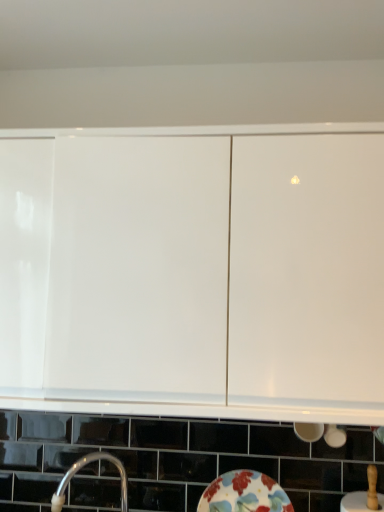
Locate an element on the screen. floral ceramic plate at lower center is located at coordinates (244, 494).

The width and height of the screenshot is (384, 512). Describe the element at coordinates (80, 469) in the screenshot. I see `silver metallic tap at lower left` at that location.

Locate an element on the screen. floral ceramic plate at lower center is located at coordinates (244, 494).

From the image's perspective, between silver metallic tap at lower left and white glossy cabinet at upper center, which one is located above?

white glossy cabinet at upper center appears higher in the image.

From their relative heights in the image, would you say silver metallic tap at lower left is taller or shorter than white glossy cabinet at upper center?

silver metallic tap at lower left is shorter than white glossy cabinet at upper center.

Does silver metallic tap at lower left have a greater width compared to white glossy cabinet at upper center?

In fact, silver metallic tap at lower left might be narrower than white glossy cabinet at upper center.

Choose the correct answer: Is silver metallic tap at lower left inside white glossy cabinet at upper center or outside it?

silver metallic tap at lower left is not enclosed by white glossy cabinet at upper center.

In terms of size, does floral ceramic plate at lower center appear bigger or smaller than white glossy cabinet at upper center?

In the image, floral ceramic plate at lower center appears to be smaller than white glossy cabinet at upper center.

Considering the sizes of floral ceramic plate at lower center and white glossy cabinet at upper center in the image, is floral ceramic plate at lower center taller or shorter than white glossy cabinet at upper center?

In the image, floral ceramic plate at lower center appears to be shorter than white glossy cabinet at upper center.

Is floral ceramic plate at lower center positioned with its back to white glossy cabinet at upper center?

No, floral ceramic plate at lower center's orientation is not away from white glossy cabinet at upper center.

From a real-world perspective, relative to floral ceramic plate at lower center, is silver metallic tap at lower left vertically above or below?

From a real-world perspective, silver metallic tap at lower left is physically above floral ceramic plate at lower center.

Would you say silver metallic tap at lower left is a long distance from floral ceramic plate at lower center?

silver metallic tap at lower left is actually quite close to floral ceramic plate at lower center.

Can you tell me how much silver metallic tap at lower left and floral ceramic plate at lower center differ in facing direction?

silver metallic tap at lower left and floral ceramic plate at lower center are facing 54.7 degrees away from each other.

Can you confirm if silver metallic tap at lower left is smaller than floral ceramic plate at lower center?

Incorrect, silver metallic tap at lower left is not smaller in size than floral ceramic plate at lower center.

Consider the image. Is white glossy cabinet at upper center wider or thinner than silver metallic tap at lower left?

white glossy cabinet at upper center is wider than silver metallic tap at lower left.

Can you tell me how much white glossy cabinet at upper center and silver metallic tap at lower left differ in facing direction?

Result: 54.3 degrees.

In the image, there is a silver metallic tap at lower left. At what (x,y) coordinates should I click in order to perform the action: click on cabinetry above it (from the image's perspective). Please return your answer as a coordinate pair (x, y). The width and height of the screenshot is (384, 512). Looking at the image, I should click on (218, 272).

From a real-world perspective, between white glossy cabinet at upper center and silver metallic tap at lower left, who is vertically higher?

From a 3D spatial view, white glossy cabinet at upper center is above.

From a real-world perspective, who is located lower, floral ceramic plate at lower center or silver metallic tap at lower left?

floral ceramic plate at lower center, from a real-world perspective.

How different are the orientations of floral ceramic plate at lower center and silver metallic tap at lower left in degrees?

54.7 degrees.

Is floral ceramic plate at lower center placed right next to silver metallic tap at lower left?

No, floral ceramic plate at lower center is not next to silver metallic tap at lower left.

You are a GUI agent. You are given a task and a screenshot of the screen. Output one action in this format:
    pyautogui.click(x=<x>, y=<y>)
    Task: Click on the tap that appears on the left of floral ceramic plate at lower center
    The image size is (384, 512).
    Given the screenshot: What is the action you would take?
    pyautogui.click(x=80, y=469)

Is white glossy cabinet at upper center to the right of floral ceramic plate at lower center from the viewer's perspective?

No.

From the image's perspective, is white glossy cabinet at upper center located above or below floral ceramic plate at lower center?

Clearly, from the image's perspective, white glossy cabinet at upper center is above floral ceramic plate at lower center.

From a real-world perspective, is white glossy cabinet at upper center positioned above or below floral ceramic plate at lower center?

white glossy cabinet at upper center is situated higher than floral ceramic plate at lower center in the real world.

Image resolution: width=384 pixels, height=512 pixels. I want to click on cabinetry that is in front of the silver metallic tap at lower left, so click(x=218, y=272).

This screenshot has width=384, height=512. Find the location of `cabinetry located above the floral ceramic plate at lower center (from the image's perspective)`. cabinetry located above the floral ceramic plate at lower center (from the image's perspective) is located at coordinates (218, 272).

From the picture: From the image, which object appears to be nearer to silver metallic tap at lower left, white glossy cabinet at upper center or floral ceramic plate at lower center?

The object closer to silver metallic tap at lower left is floral ceramic plate at lower center.

Which object lies further to the anchor point white glossy cabinet at upper center, silver metallic tap at lower left or floral ceramic plate at lower center?

Based on the image, silver metallic tap at lower left appears to be further to white glossy cabinet at upper center.

Based on their spatial positions, is white glossy cabinet at upper center or silver metallic tap at lower left closer to floral ceramic plate at lower center?

silver metallic tap at lower left.

Looking at the image, which one is located further to floral ceramic plate at lower center, silver metallic tap at lower left or white glossy cabinet at upper center?

white glossy cabinet at upper center is further to floral ceramic plate at lower center.

Which object lies nearer to the anchor point white glossy cabinet at upper center, floral ceramic plate at lower center or silver metallic tap at lower left?

floral ceramic plate at lower center is positioned closer to the anchor white glossy cabinet at upper center.

Which object lies nearer to the anchor point silver metallic tap at lower left, floral ceramic plate at lower center or white glossy cabinet at upper center?

The object closer to silver metallic tap at lower left is floral ceramic plate at lower center.

Image resolution: width=384 pixels, height=512 pixels. I want to click on tap between white glossy cabinet at upper center and floral ceramic plate at lower center in the up-down direction, so click(x=80, y=469).